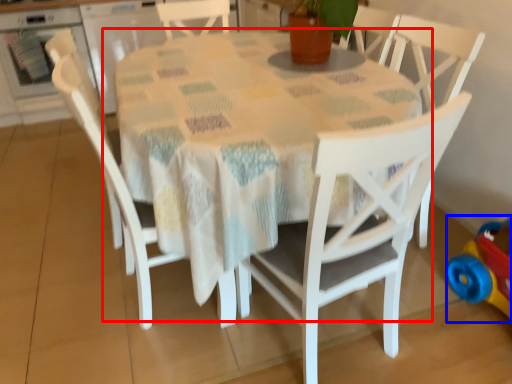
Question: Which of the following is the farthest to the observer, table (highlighted by a red box) or toy (highlighted by a blue box)?

Choices:
 (A) table
 (B) toy

Answer: (B)